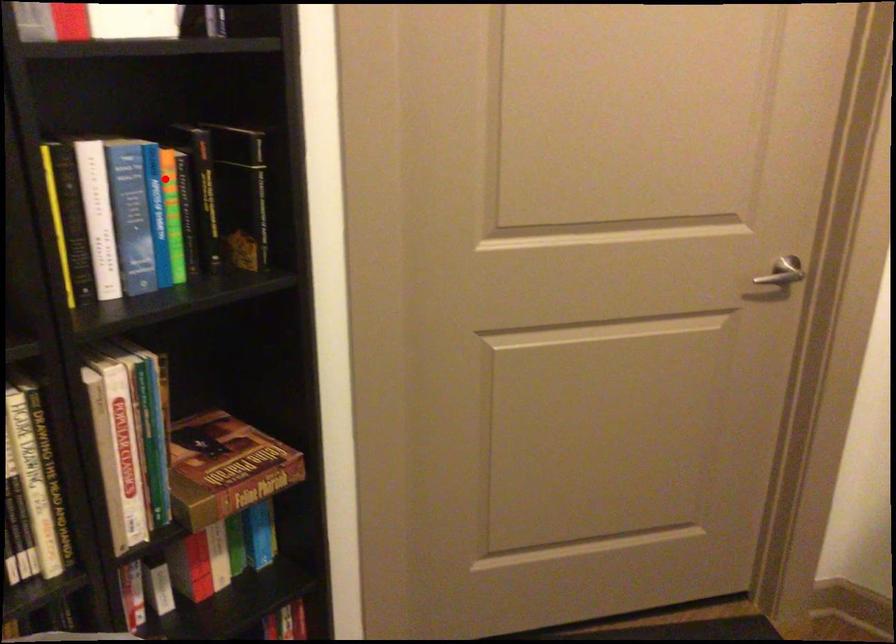
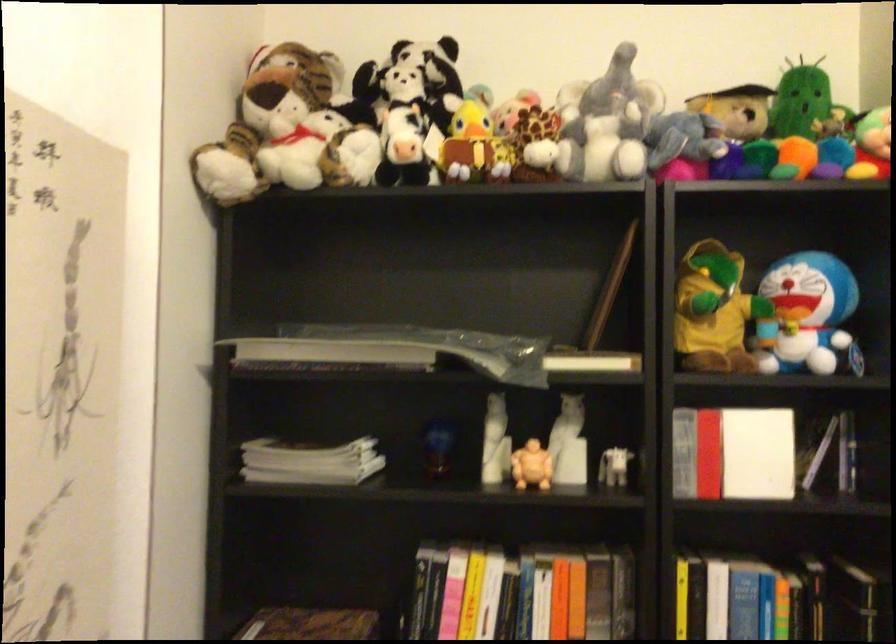
Locate, in the second image, the point that corresponds to the highlighted location in the first image.

(780, 599)